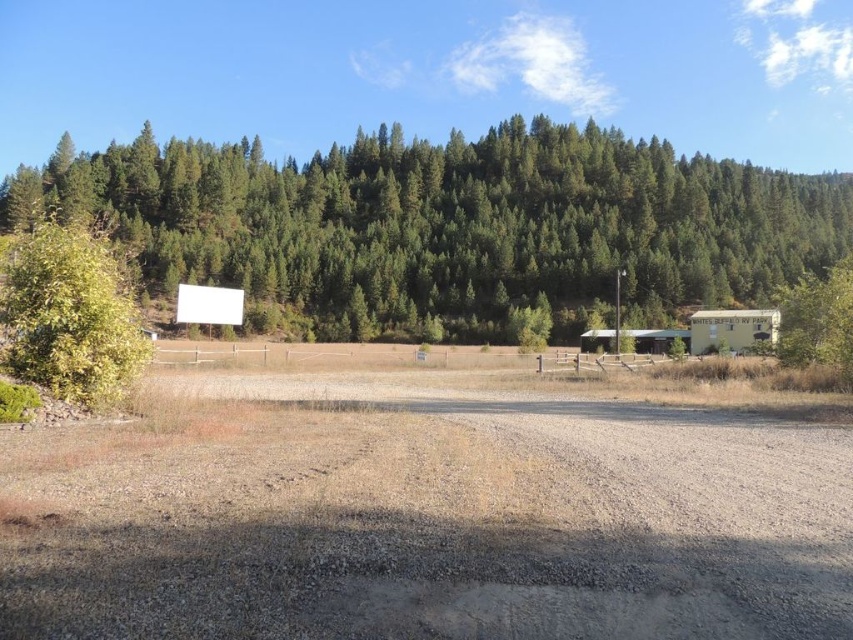
You are standing at the point with coordinates point (370, 170) and want to walk towards the point with coordinates point (498, 627). Which direction should you face to walk directly towards your destination?

Since point (498, 627) is in front of point (370, 170), you should face forward to walk directly towards your destination.

You are a hiker standing at the green leafy bush at left and want to reach the green textured pine trees at upper center. Given that your average walking pace is 1.5 meters per second, how long would it take you to walk directly to the pine trees?

The distance between the green textured pine trees at upper center and the green leafy bush at left is 579.01 meters. At a walking pace of 1.5 meters per second, it would take approximately 579.01 divided by 1.5, which equals about 386 seconds, or roughly 6 minutes and 26 seconds, to reach the pine trees.